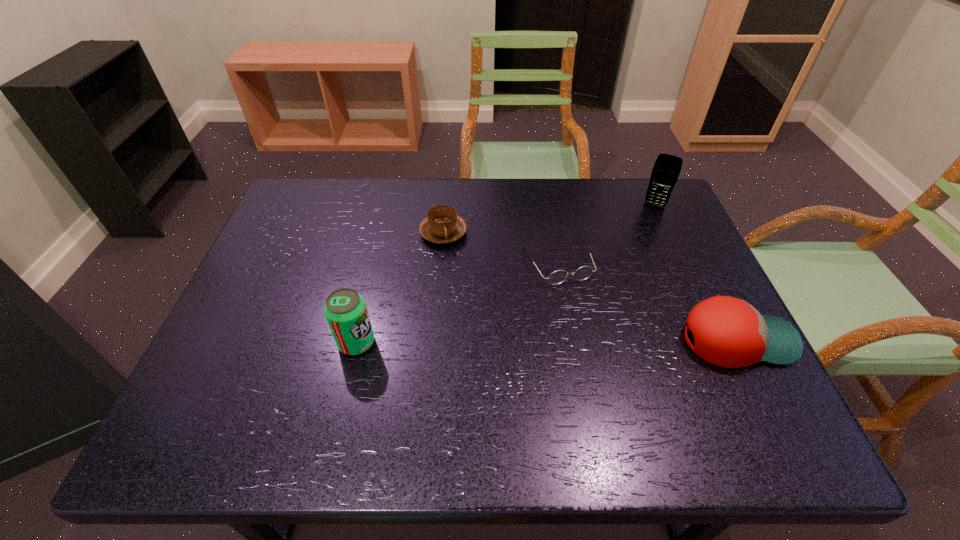
Point out which object is positioned as the second nearest to the farthest object. Please provide its 2D coordinates. Your answer should be formatted as a tuple, i.e. [(x, y)], where the tuple contains the x and y coordinates of a point satisfying the conditions above.

[(728, 332)]

Choose which object is the nearest neighbor to the third shortest object. Please provide its 2D coordinates. Your answer should be formatted as a tuple, i.e. [(x, y)], where the tuple contains the x and y coordinates of a point satisfying the conditions above.

[(559, 276)]

Find the location of a particular element. The height and width of the screenshot is (540, 960). free space that satisfies the following two spatial constraints: 1. on the front side of the farthest object; 2. at the brim of the third tallest object is located at coordinates [716, 340].

You are a GUI agent. You are given a task and a screenshot of the screen. Output one action in this format:
    pyautogui.click(x=<x>, y=<y>)
    Task: Click on the vacant area that satisfies the following two spatial constraints: 1. on the front side of the cappuccino; 2. at the brim of the third shortest object
    
    Given the screenshot: What is the action you would take?
    pyautogui.click(x=434, y=340)

Identify the location of vacant position in the image that satisfies the following two spatial constraints: 1. on the back side of the cappuccino; 2. on the left side of the farthest object. The height and width of the screenshot is (540, 960). (445, 205).